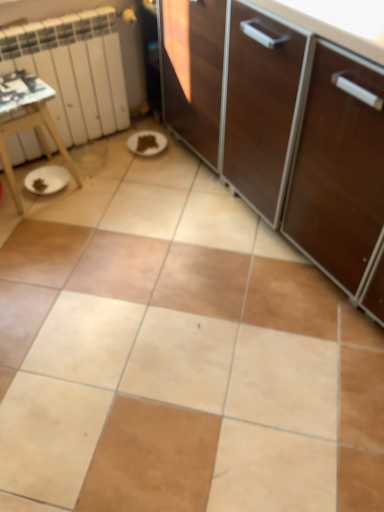
The height and width of the screenshot is (512, 384). In order to click on free location in front of white matte radiator at left in this screenshot , I will do `click(90, 204)`.